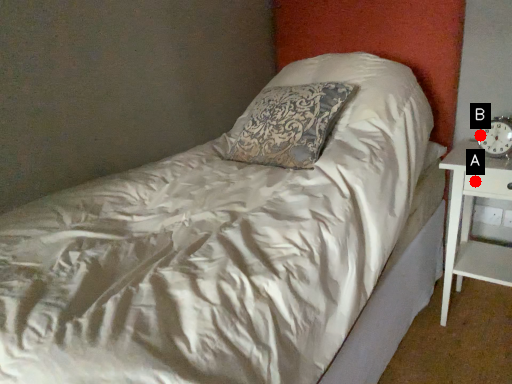
Question: Two points are circled on the image, labeled by A and B beside each circle. Which point is further to the camera?

Choices:
 (A) A is further
 (B) B is further

Answer: (B)